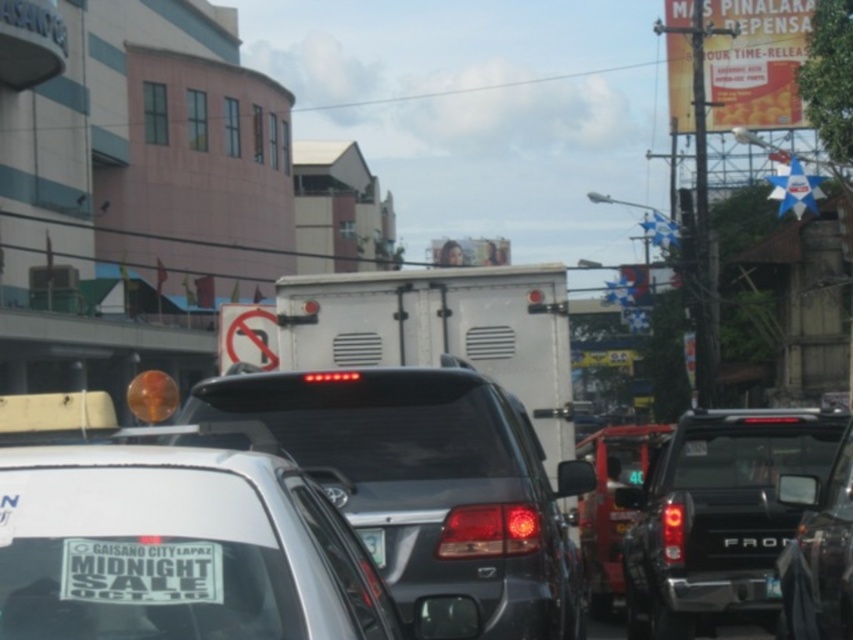
Consider the image. Is glossy black truck at center-right bigger than white sticker at lower center?

Yes.

Which is behind, point (659, 552) or point (68, 600)?

The point (659, 552) is more distant.

Where is `glossy black truck at center-right`? This screenshot has width=853, height=640. glossy black truck at center-right is located at coordinates (717, 516).

Looking at this image, does white glossy car at center have a greater height compared to white sticker at lower center?

Indeed, white glossy car at center has a greater height compared to white sticker at lower center.

Can you confirm if white glossy car at center is smaller than white sticker at lower center?

No.

Is point (363, 570) positioned in front of point (169, 572)?

No.

At what (x,y) coordinates should I click in order to perform the action: click on white glossy car at center. Please return your answer as a coordinate pair (x, y). The width and height of the screenshot is (853, 640). Looking at the image, I should click on (177, 548).

Can you confirm if glossy black car at center is positioned above black plastic license plate at center?

Indeed, glossy black car at center is positioned over black plastic license plate at center.

Does glossy black car at center have a lesser width compared to black plastic license plate at center?

Incorrect, glossy black car at center's width is not less than black plastic license plate at center's.

Locate an element on the screen. The width and height of the screenshot is (853, 640). glossy black car at center is located at coordinates (428, 483).

Image resolution: width=853 pixels, height=640 pixels. Find the location of `glossy black car at center`. glossy black car at center is located at coordinates (428, 483).